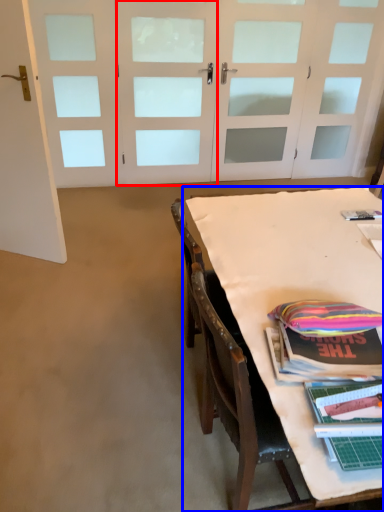
Question: Which object appears closest to the camera in this image, door (highlighted by a red box) or table (highlighted by a blue box)?

Choices:
 (A) door
 (B) table

Answer: (B)